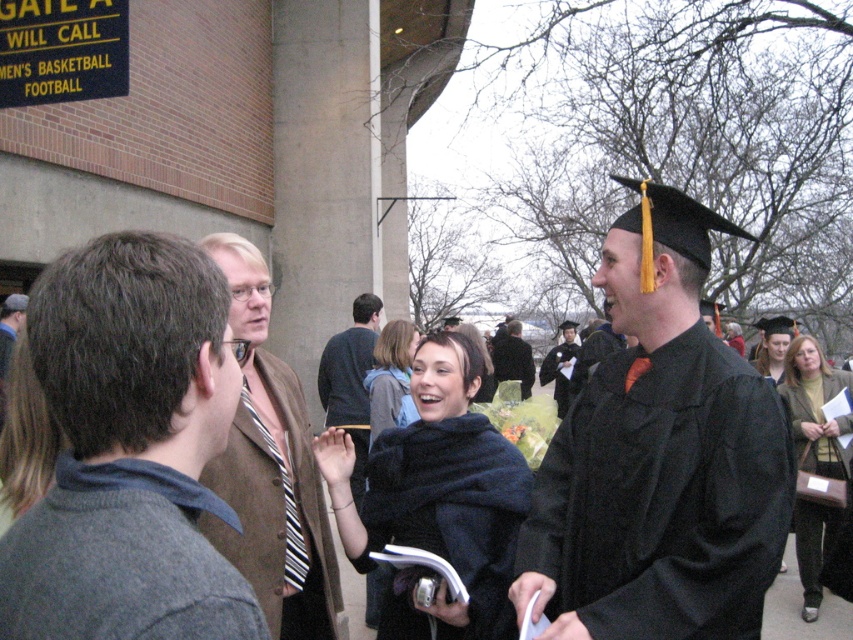
Question: Considering the relative positions of dark brown leather jacket at center and matte black graduation cap at upper right in the image provided, where is dark brown leather jacket at center located with respect to matte black graduation cap at upper right?

Choices:
 (A) below
 (B) above

Answer: (A)

Question: Among these points, which one is nearest to the camera?

Choices:
 (A) (245, 266)
 (B) (339, 376)

Answer: (A)

Question: Is striped tie at center bigger than black fuzzy coat at center?

Choices:
 (A) no
 (B) yes

Answer: (A)

Question: Which point is farther to the camera?

Choices:
 (A) (236, 509)
 (B) (498, 356)
 (C) (738, 419)
 (D) (357, 570)

Answer: (B)

Question: Which is farther from the gray wool sweater at left?

Choices:
 (A) black fuzzy coat at center
 (B) matte black graduation cap at upper right

Answer: (B)

Question: Observing the image, what is the correct spatial positioning of matte black graduation gown at right in reference to matte black graduation gown at center?

Choices:
 (A) below
 (B) above

Answer: (A)